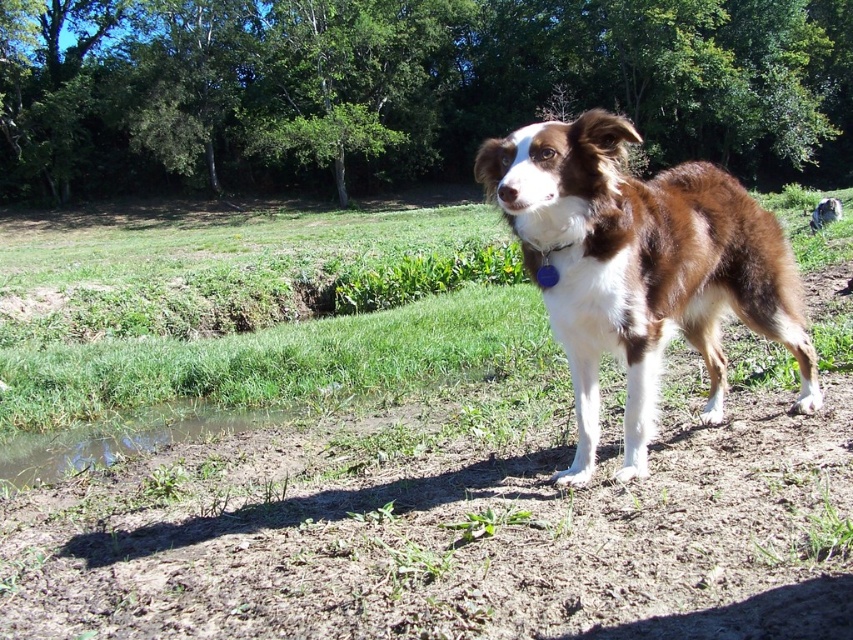
Question: Which object is positioned closest to the brown/white fur dog at center?

Choices:
 (A) green leafy tree at upper center
 (B) brown dirt field at center

Answer: (B)

Question: Is green leafy tree at upper center below brown/white fur dog at center?

Choices:
 (A) no
 (B) yes

Answer: (A)

Question: Which point is closer to the camera?

Choices:
 (A) brown/white fur dog at center
 (B) brown dirt field at center
 (C) green leafy tree at upper center

Answer: (B)

Question: Observing the image, what is the correct spatial positioning of green leafy tree at upper center in reference to brown/white fur dog at center?

Choices:
 (A) left
 (B) right

Answer: (A)

Question: Which point is closer to the camera taking this photo?

Choices:
 (A) (843, 545)
 (B) (833, 124)

Answer: (A)

Question: Can you confirm if brown dirt field at center is thinner than green leafy tree at upper center?

Choices:
 (A) yes
 (B) no

Answer: (A)